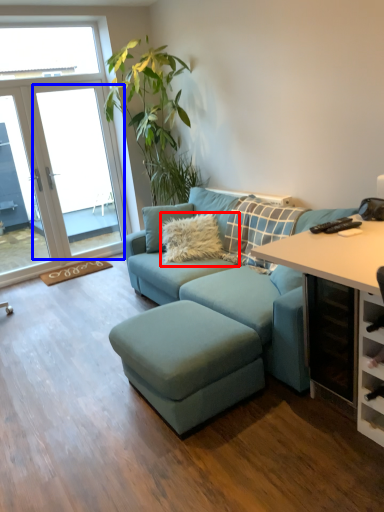
Question: Which object is further to the camera taking this photo, pillow (highlighted by a red box) or window screen (highlighted by a blue box)?

Choices:
 (A) pillow
 (B) window screen

Answer: (B)